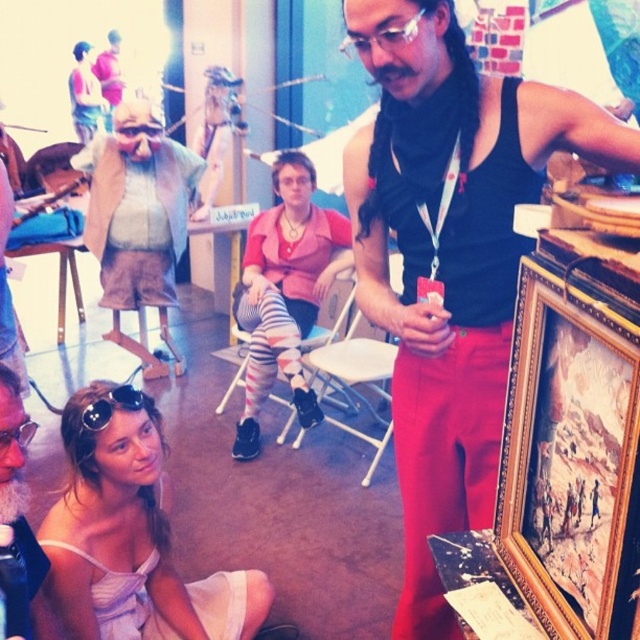
You are standing in the center of the room and want to move towards the goldwooden frame at right. Which direction should you move to avoid stepping on the white fabric dress at lower left?

You should move to the right side of the room since the goldwooden frame at right is located to the right of the white fabric dress at lower left, so moving right will keep you clear of the white fabric dress at lower left.

You are an artist trying to hang a new painting on the wall. You have two items in the scene to choose from for this task. Which item is shorter in height between the goldwooden frame at right and the white fabric dress at lower left?

The goldwooden frame at right is not as tall as the white fabric dress at lower left, so the goldwooden frame at right is shorter in height.

You are an event planner trying to arrange seating for a photo shoot. You need to place two models wearing the pink fabric shirt at center and the matte pink shirt at upper left. Based on their clothing, which model should stand behind the other to create a layered look?

The pink fabric shirt at center should stand behind the matte pink shirt at upper left because the pink fabric shirt at center is much taller, allowing it to be positioned behind while still being visible over the top.